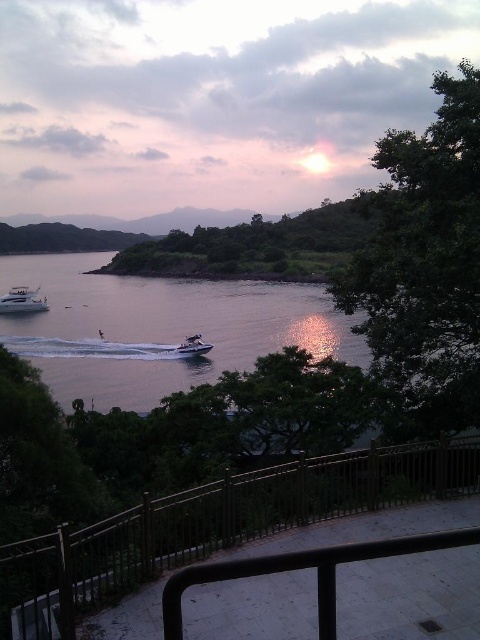
Question: Among these points, which one is nearest to the camera?

Choices:
 (A) (197, 342)
 (B) (13, 291)

Answer: (A)

Question: Which point is farther to the camera?

Choices:
 (A) (28, 305)
 (B) (190, 346)

Answer: (A)

Question: Does clear water at lower left appear over white glossy yacht at lower left?

Choices:
 (A) yes
 (B) no

Answer: (A)

Question: Where is metallic rail at center located in relation to white glossy yacht at lower left in the image?

Choices:
 (A) left
 (B) right

Answer: (B)

Question: Considering the relative positions of metallic rail at center and white glossy yacht at lower left in the image provided, where is metallic rail at center located with respect to white glossy yacht at lower left?

Choices:
 (A) left
 (B) right

Answer: (B)

Question: Which of the following is the farthest from the observer?

Choices:
 (A) white glossy yacht at lower left
 (B) metallic rail at center
 (C) clear water at lower left
 (D) metallic silver jet ski at center

Answer: (A)